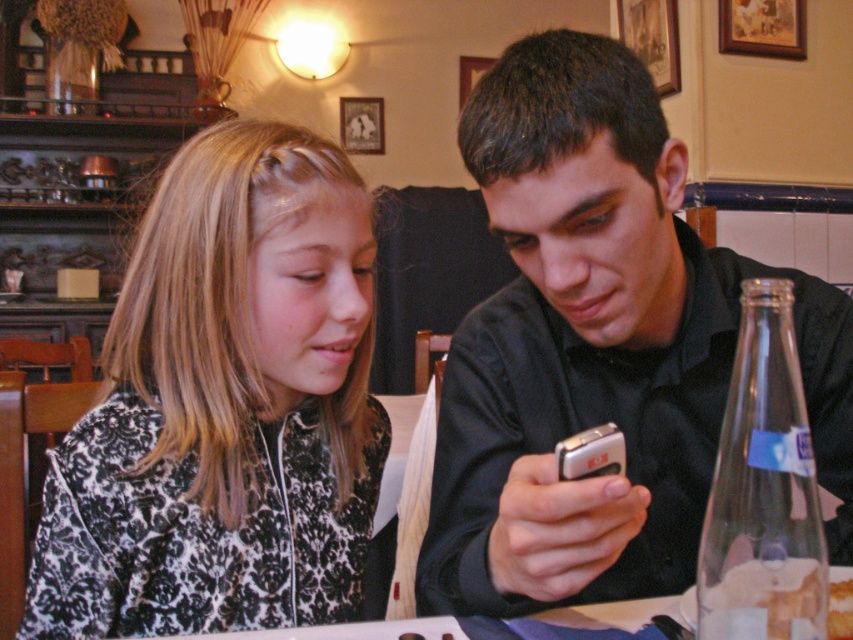
From the picture: Measure the distance between black damask jacket at left and translucent glass bread at lower right.

A distance of 42.74 centimeters exists between black damask jacket at left and translucent glass bread at lower right.

Is point (283, 346) positioned in front of point (804, 630)?

No, it is not.

Find the location of a particular element. The width and height of the screenshot is (853, 640). black damask jacket at left is located at coordinates (224, 406).

Is black matte shirt at center above translucent glass bread at lower right?

Correct, black matte shirt at center is located above translucent glass bread at lower right.

Who is lower down, black matte shirt at center or translucent glass bread at lower right?

translucent glass bread at lower right is below.

Between point (480, 602) and point (808, 616), which one is positioned in front?

Point (808, 616) is in front.

Where is `black matte shirt at center`? black matte shirt at center is located at coordinates (598, 348).

Who is more forward, (669,486) or (189,189)?

Point (189,189) is more forward.

This screenshot has width=853, height=640. Describe the element at coordinates (598, 348) in the screenshot. I see `black matte shirt at center` at that location.

Is point (831, 547) positioned after point (302, 246)?

Yes, it is.

Find the location of a particular element. The height and width of the screenshot is (640, 853). black matte shirt at center is located at coordinates (598, 348).